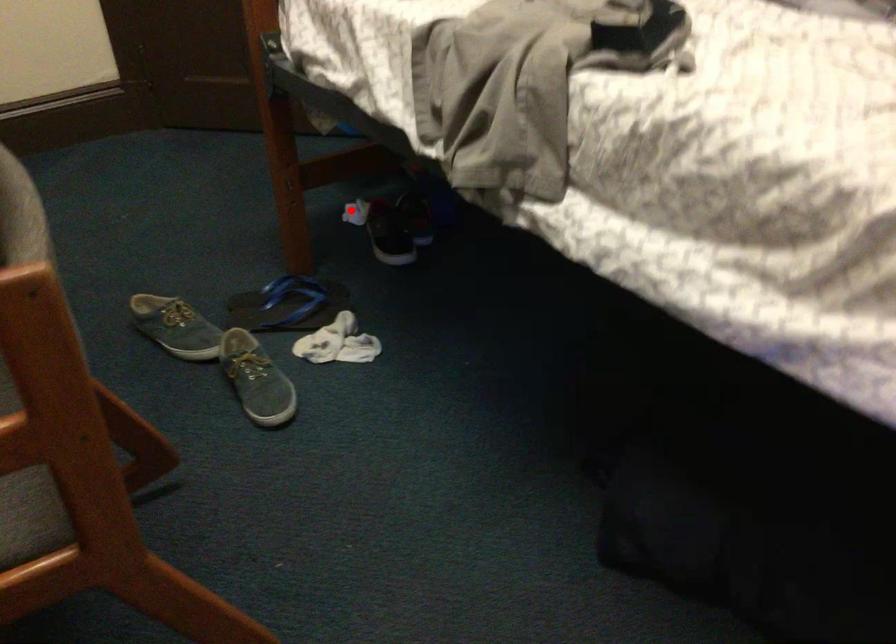
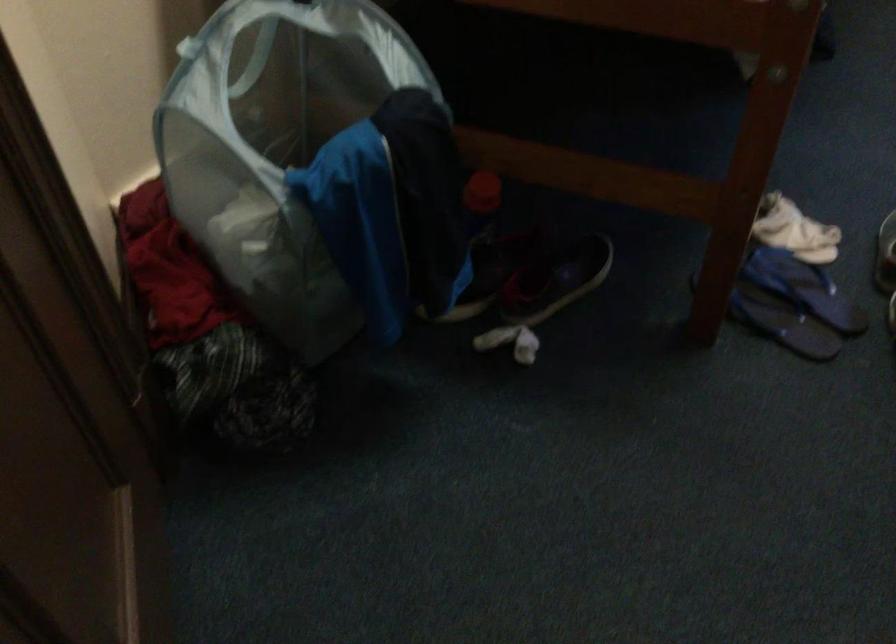
In the second image, find the point that corresponds to the highlighted location in the first image.

(510, 342)